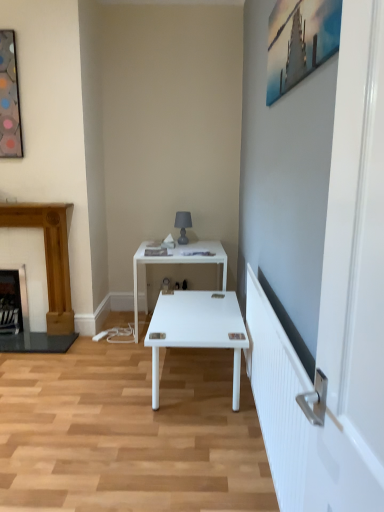
Question: From a real-world perspective, does metallic silver painting at upper right, placed as the 1th picture frame when sorted from right to left, stand above matte gray lamp at upper center?

Choices:
 (A) no
 (B) yes

Answer: (B)

Question: Is metallic silver painting at upper right, the second picture frame positioned from the left, bigger than matte gray lamp at upper center?

Choices:
 (A) yes
 (B) no

Answer: (A)

Question: Is metallic silver painting at upper right, placed as the 1th picture frame when sorted from right to left, placed right next to matte gray lamp at upper center?

Choices:
 (A) yes
 (B) no

Answer: (B)

Question: Can you confirm if metallic silver painting at upper right, the second picture frame positioned from the left, is positioned to the right of matte gray lamp at upper center?

Choices:
 (A) no
 (B) yes

Answer: (B)

Question: Is metallic silver painting at upper right, the second picture frame positioned from the left, located outside matte gray lamp at upper center?

Choices:
 (A) yes
 (B) no

Answer: (A)

Question: Does metallic silver painting at upper right, placed as the 1th picture frame when sorted from right to left, appear on the left side of matte gray lamp at upper center?

Choices:
 (A) no
 (B) yes

Answer: (A)

Question: Is black metal fireplace at left, placed as the 2th fireplace when sorted from right to left, at the back of metallic silver painting at upper right, placed as the 1th picture frame when sorted from right to left?

Choices:
 (A) no
 (B) yes

Answer: (A)

Question: Is metallic silver painting at upper right, placed as the 1th picture frame when sorted from right to left, wider than black metal fireplace at left, placed as the 2th fireplace when sorted from right to left?

Choices:
 (A) yes
 (B) no

Answer: (B)

Question: Does metallic silver painting at upper right, the second picture frame from the back, have a greater height compared to black metal fireplace at left, placed as the 2th fireplace when sorted from right to left?

Choices:
 (A) no
 (B) yes

Answer: (A)

Question: Does metallic silver painting at upper right, which is the 1th picture frame in front-to-back order, lie in front of black metal fireplace at left, the 1th fireplace from the left?

Choices:
 (A) no
 (B) yes

Answer: (B)

Question: Does metallic silver painting at upper right, which is the 1th picture frame in front-to-back order, have a lesser width compared to black metal fireplace at left, the 1th fireplace from the left?

Choices:
 (A) no
 (B) yes

Answer: (B)

Question: From the image's perspective, is metallic silver painting at upper right, the second picture frame from the back, below black metal fireplace at left, placed as the 2th fireplace when sorted from right to left?

Choices:
 (A) no
 (B) yes

Answer: (A)

Question: Does metallic silver painting at upper right, the second picture frame from the back, have a smaller size compared to metallic glass picture frame at upper left, acting as the 2th picture frame starting from the front?

Choices:
 (A) yes
 (B) no

Answer: (B)